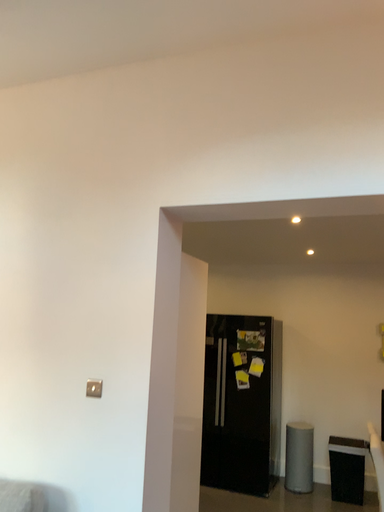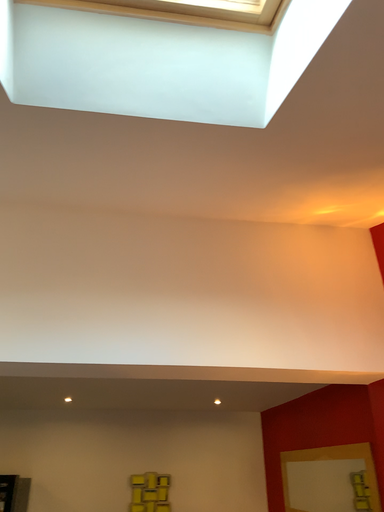
Question: How did the camera likely rotate when shooting the video?

Choices:
 (A) rotated right
 (B) rotated left

Answer: (A)